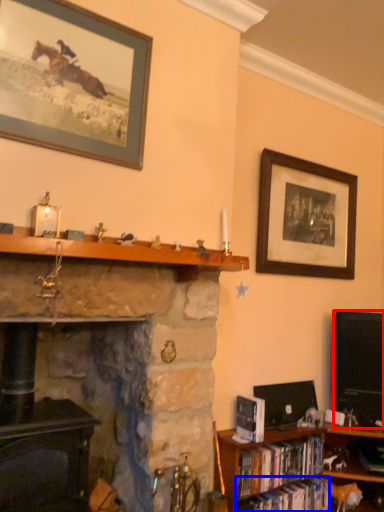
Question: Which point is closer to the camera, television (highlighted by a red box) or book (highlighted by a blue box)?

Choices:
 (A) television
 (B) book

Answer: (B)